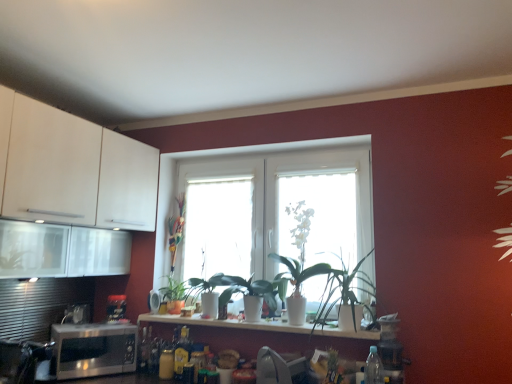
What are the coordinates of `free space above transparent glass window at center, which is counted as the 1th window, starting from the left (from a real-world perspective)` in the screenshot? It's located at (220, 180).